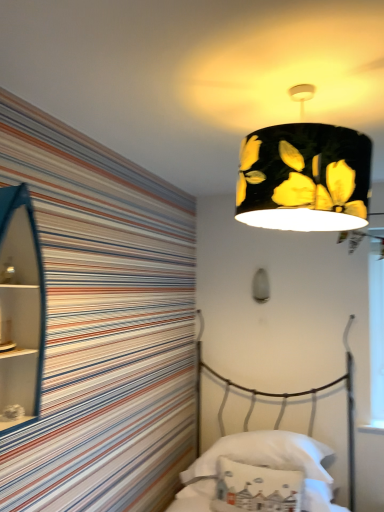
You are a GUI agent. You are given a task and a screenshot of the screen. Output one action in this format:
    pyautogui.click(x=<x>, y=<y>)
    Task: Click on the free space above black matte lampshade at upper center, which ranks as the second lamp in back-to-front order (from a real-world perspective)
    Image resolution: width=384 pixels, height=512 pixels.
    Given the screenshot: What is the action you would take?
    coord(309,83)